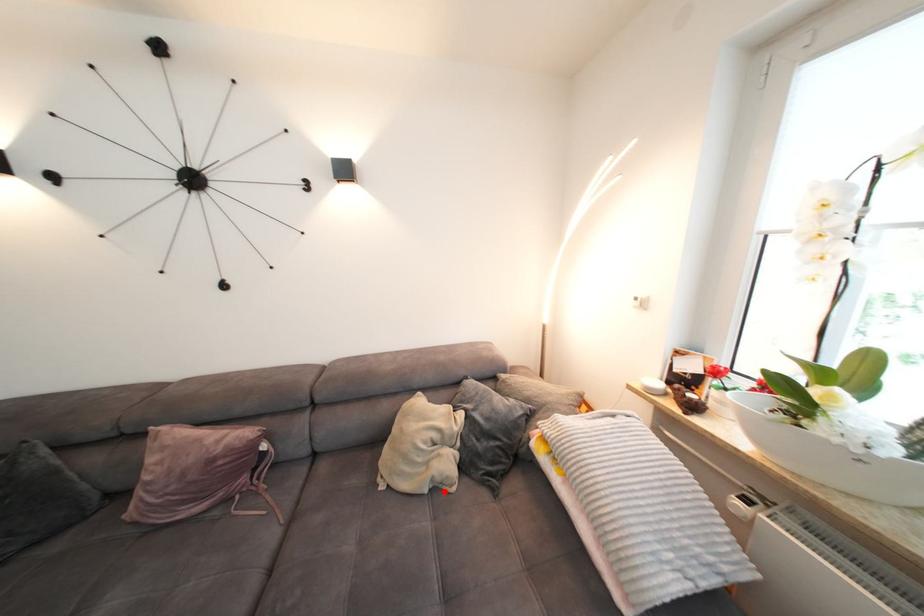
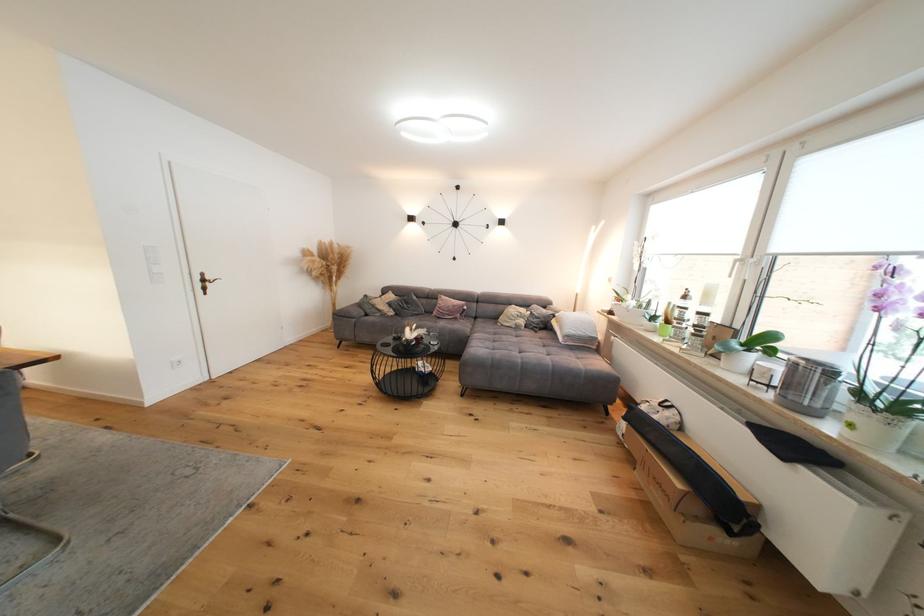
Find the pixel in the second image that matches the highlighted location in the first image.

(524, 330)